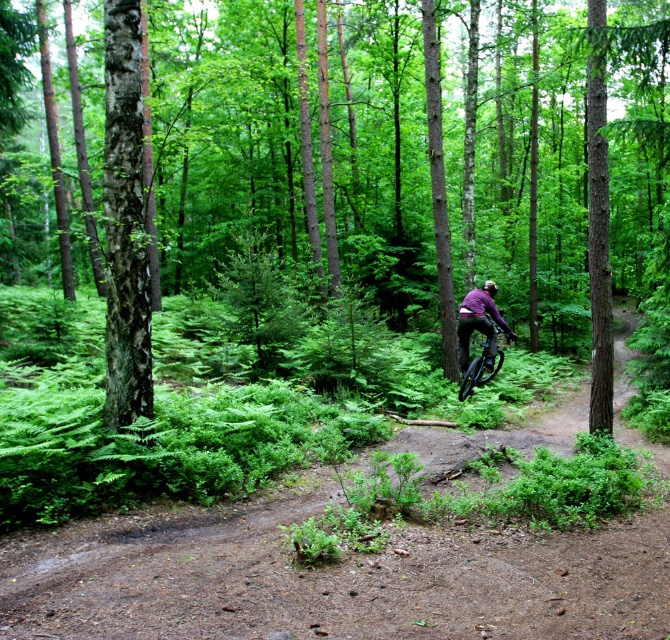
You are a hiker trying to navigate through the forest and spot the green bark tree at center and the smooth bark tree at left. According to the scene, which tree is positioned more to the left?

The smooth bark tree at left is positioned more to the left compared to the green bark tree at center.